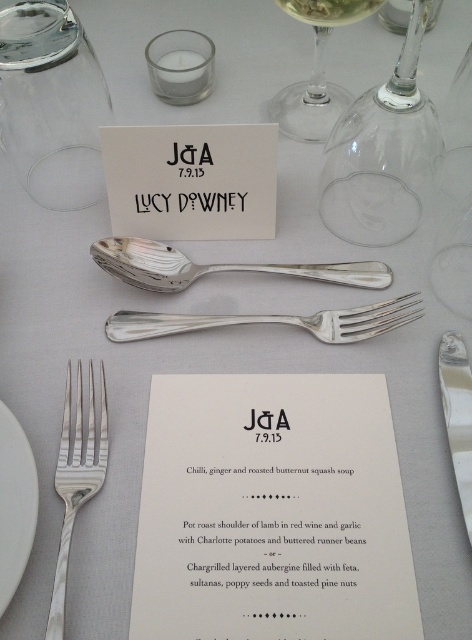
Can you confirm if silver polished spoon at center is smaller than white ceramic plate at lower left?

No, silver polished spoon at center is not smaller than white ceramic plate at lower left.

Locate an element on the screen. silver polished spoon at center is located at coordinates (216, 266).

Where is `silver polished spoon at center`? The image size is (472, 640). silver polished spoon at center is located at coordinates (216, 266).

From the picture: Can you confirm if silver polished fork at lower left is smaller than transparent glass wine glass at upper center?

Indeed, silver polished fork at lower left has a smaller size compared to transparent glass wine glass at upper center.

Can you confirm if silver polished fork at lower left is thinner than transparent glass wine glass at upper center?

Yes, silver polished fork at lower left is thinner than transparent glass wine glass at upper center.

Where is `silver polished fork at lower left`? The height and width of the screenshot is (640, 472). silver polished fork at lower left is located at coordinates (76, 477).

The height and width of the screenshot is (640, 472). Identify the location of silver polished fork at lower left. (76, 477).

Who is higher up, transparent glass wine glass at upper right or white ceramic plate at lower left?

Positioned higher is transparent glass wine glass at upper right.

Is transparent glass wine glass at upper right smaller than white ceramic plate at lower left?

No, transparent glass wine glass at upper right is not smaller than white ceramic plate at lower left.

Is point (367, 177) positioned in front of point (9, 600)?

That is False.

Identify the location of transparent glass wine glass at upper right. The height and width of the screenshot is (640, 472). (382, 154).